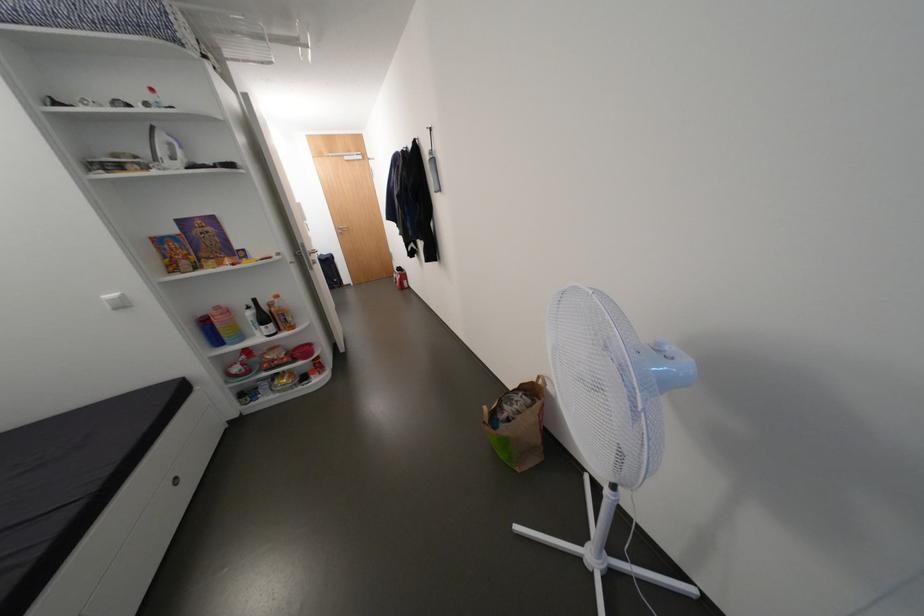
Image resolution: width=924 pixels, height=616 pixels. What do you see at coordinates (662, 349) in the screenshot?
I see `a fan control buttons` at bounding box center [662, 349].